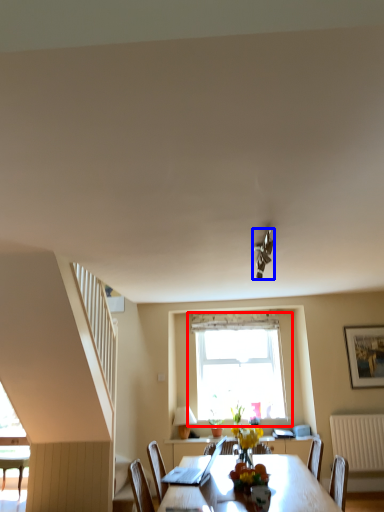
Question: Which of the following is the farthest to the observer, window (highlighted by a red box) or light fixture (highlighted by a blue box)?

Choices:
 (A) window
 (B) light fixture

Answer: (A)